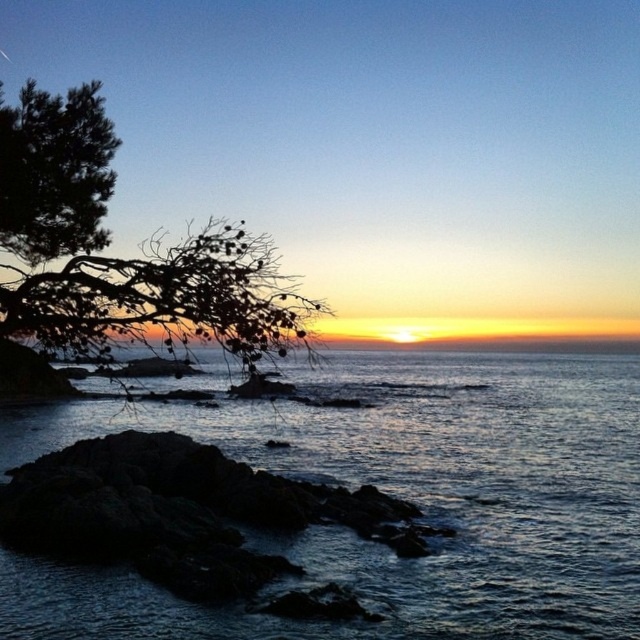
You are a photographer planning to capture the sunset scene. You have a camera with a 24mm lens that can capture a horizontal field of view of 84 degrees. The dark blue water at center and dark green leafy tree at left are both in your frame. Considering their relative sizes in the image, which object would appear larger in your photograph?

The dark green leafy tree at left appears larger in the photograph because it is taller than the dark blue water at center, which is shorter.

You are a photographer trying to capture the sunset. You have a camera with a wide angle lens that can capture a horizontal span of 120 degrees. You are positioned such that the dark blue water at center and the dark rock at lower left are both in your view. Can you fit both objects into a single frame without moving your position?

Since the dark blue water at center is to the right of the dark rock at lower left, the horizontal distance between them is within the 120 degree span of your wide angle lens. Therefore, you can capture both the dark blue water at center and the dark rock at lower left in a single frame without moving.